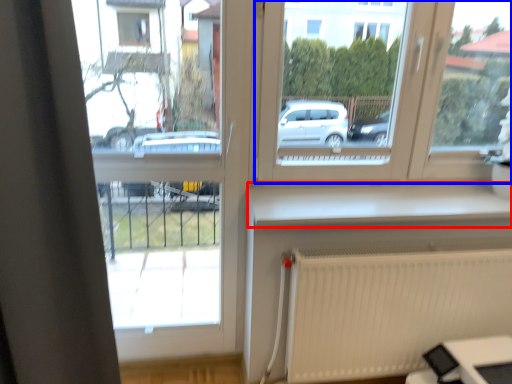
Question: Which object appears closest to the camera in this image, window sill (highlighted by a red box) or window (highlighted by a blue box)?

Choices:
 (A) window sill
 (B) window

Answer: (B)